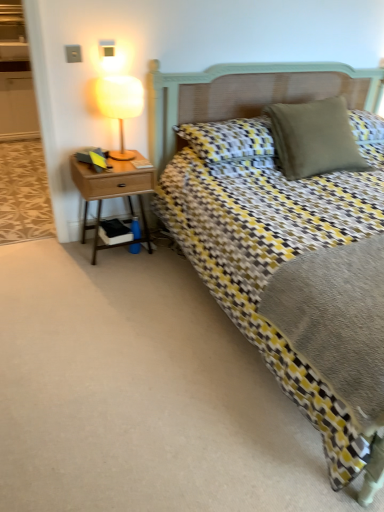
Question: In which direction should I rotate to look at textured beige pillow at center, which is the first pillow in left-to-right order?

Choices:
 (A) right
 (B) left

Answer: (A)

Question: From the image's perspective, is matte yellow lampshade at upper left over woodennightstand at left?

Choices:
 (A) no
 (B) yes

Answer: (B)

Question: Can you confirm if matte yellow lampshade at upper left is taller than woodennightstand at left?

Choices:
 (A) no
 (B) yes

Answer: (A)

Question: From a real-world perspective, is matte yellow lampshade at upper left positioned under woodennightstand at left based on gravity?

Choices:
 (A) no
 (B) yes

Answer: (A)

Question: Considering the relative sizes of matte yellow lampshade at upper left and woodennightstand at left in the image provided, is matte yellow lampshade at upper left smaller than woodennightstand at left?

Choices:
 (A) no
 (B) yes

Answer: (B)

Question: Is matte yellow lampshade at upper left facing towards woodennightstand at left?

Choices:
 (A) no
 (B) yes

Answer: (A)

Question: Can you confirm if matte yellow lampshade at upper left is bigger than woodennightstand at left?

Choices:
 (A) no
 (B) yes

Answer: (A)

Question: Is textured beige pillow at center, the 2th pillow when ordered from right to left, taller than woodennightstand at left?

Choices:
 (A) no
 (B) yes

Answer: (A)

Question: Is textured beige pillow at center, the 2th pillow when ordered from right to left, positioned beyond the bounds of woodennightstand at left?

Choices:
 (A) no
 (B) yes

Answer: (B)

Question: Is textured beige pillow at center, which is the first pillow in left-to-right order, positioned far away from woodennightstand at left?

Choices:
 (A) no
 (B) yes

Answer: (A)

Question: Is textured beige pillow at center, which is the first pillow in left-to-right order, at the left side of woodennightstand at left?

Choices:
 (A) no
 (B) yes

Answer: (A)

Question: Is woodennightstand at left at the back of textured beige pillow at center, the 2th pillow when ordered from right to left?

Choices:
 (A) yes
 (B) no

Answer: (B)

Question: From the image's perspective, is textured beige pillow at center, which is the first pillow in left-to-right order, above woodennightstand at left?

Choices:
 (A) no
 (B) yes

Answer: (B)

Question: Is matte yellow lampshade at upper left next to matte beige pillow at upper right, acting as the 1th pillow starting from the right, and touching it?

Choices:
 (A) no
 (B) yes

Answer: (A)